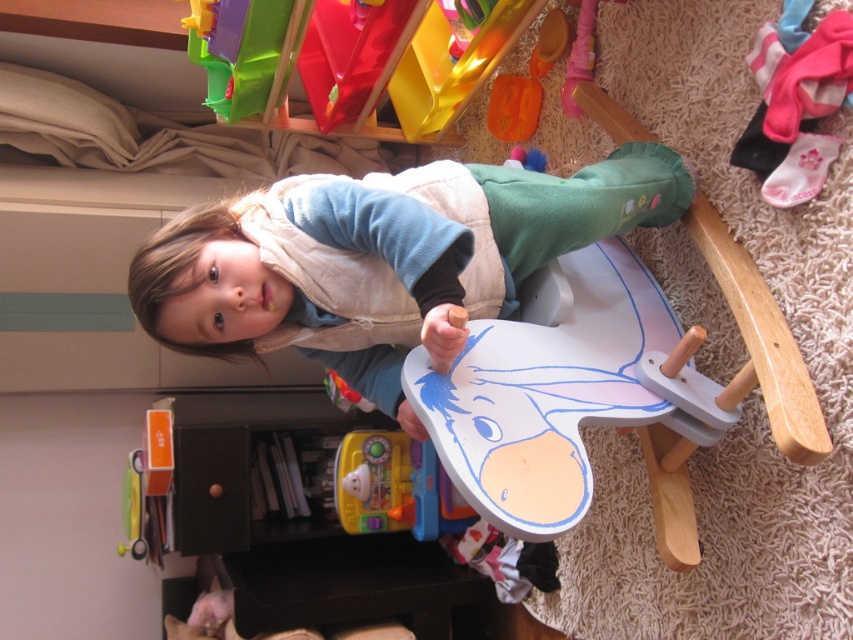
You are a parent trying to clean up the playroom. You see the yellow plastic toy at lower center and the metallic yellow toy at lower left. Which toy should you pick up first if you want to put the bigger one away first?

The yellow plastic toy at lower center is larger than the metallic yellow toy at lower left, so you should pick up the yellow plastic toy at lower center first.

You are a parent trying to ensure your child stays safe while playing. The child is currently sitting on the rocking horse wearing the matte white vest at center and holding the yellow plastic toy at lower center. Based on the distance between them, is there a risk of the toy slipping out of the child hand and hitting the vest?

The matte white vest at center is 3.72 feet away from the yellow plastic toy at lower center. Since the distance is relatively large, the toy is unlikely to slip and hit the vest if dropped.

You are a parent looking for a place to store some toys. You see the wooden rocking horse at lower right and the brown matte drawer at lower left. Which object is located to the right side of the other?

The wooden rocking horse at lower right is located to the right of the brown matte drawer at lower left.